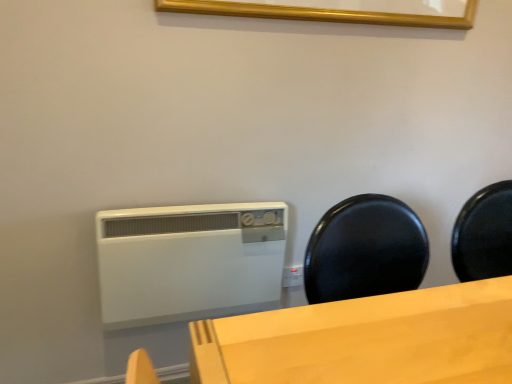
The width and height of the screenshot is (512, 384). I want to click on gold wooden picture frame at upper center, so click(335, 12).

What is the approximate height of gold wooden picture frame at upper center?

The height of gold wooden picture frame at upper center is 4.06 inches.

Describe the element at coordinates (335, 12) in the screenshot. The image size is (512, 384). I see `gold wooden picture frame at upper center` at that location.

What do you see at coordinates (189, 261) in the screenshot? This screenshot has width=512, height=384. I see `white plastic heater at center` at bounding box center [189, 261].

You are a GUI agent. You are given a task and a screenshot of the screen. Output one action in this format:
    pyautogui.click(x=<x>, y=<y>)
    Task: Click on the white plastic heater at center
    This screenshot has height=384, width=512.
    Given the screenshot: What is the action you would take?
    pyautogui.click(x=189, y=261)

Where is `gold wooden picture frame at upper center`? The width and height of the screenshot is (512, 384). gold wooden picture frame at upper center is located at coordinates (335, 12).

Is gold wooden picture frame at upper center at the left side of white plastic heater at center?

No.

Which object is more forward, gold wooden picture frame at upper center or white plastic heater at center?

gold wooden picture frame at upper center is in front.

Between point (405, 22) and point (227, 209), which one is positioned behind?

Point (227, 209)

From the image's perspective, does gold wooden picture frame at upper center appear higher than white plastic heater at center?

Yes, from the image's perspective, gold wooden picture frame at upper center is above white plastic heater at center.

From a real-world perspective, is gold wooden picture frame at upper center over white plastic heater at center?

Yes, from a real-world perspective, gold wooden picture frame at upper center is over white plastic heater at center

Looking at their sizes, would you say gold wooden picture frame at upper center is wider or thinner than white plastic heater at center?

In the image, gold wooden picture frame at upper center appears to be more narrow than white plastic heater at center.

Between gold wooden picture frame at upper center and white plastic heater at center, which one has more height?

white plastic heater at center is taller.

Considering the relative sizes of gold wooden picture frame at upper center and white plastic heater at center in the image provided, is gold wooden picture frame at upper center smaller than white plastic heater at center?

Correct, gold wooden picture frame at upper center occupies less space than white plastic heater at center.

Is gold wooden picture frame at upper center inside or outside of white plastic heater at center?

gold wooden picture frame at upper center cannot be found inside white plastic heater at center.

Is gold wooden picture frame at upper center placed right next to white plastic heater at center?

gold wooden picture frame at upper center and white plastic heater at center are clearly separated.

Could you tell me if gold wooden picture frame at upper center is turned towards white plastic heater at center?

No, gold wooden picture frame at upper center is not facing towards white plastic heater at center.

How much distance is there between gold wooden picture frame at upper center and white plastic heater at center?

A distance of 30.20 inches exists between gold wooden picture frame at upper center and white plastic heater at center.

Identify the location of home appliance below the gold wooden picture frame at upper center (from the image's perspective). This screenshot has width=512, height=384. (189, 261).

Can you confirm if white plastic heater at center is positioned to the left of gold wooden picture frame at upper center?

Correct, you'll find white plastic heater at center to the left of gold wooden picture frame at upper center.

Which object is more forward, white plastic heater at center or gold wooden picture frame at upper center?

gold wooden picture frame at upper center is in front.

Which point is more distant from viewer, (243, 237) or (298, 8)?

The point (243, 237) is farther from the camera.

From the image's perspective, is white plastic heater at center positioned above or below gold wooden picture frame at upper center?

white plastic heater at center is below gold wooden picture frame at upper center.

From a real-world perspective, between white plastic heater at center and gold wooden picture frame at upper center, who is vertically lower?

white plastic heater at center.

Does white plastic heater at center have a lesser width compared to gold wooden picture frame at upper center?

Incorrect, the width of white plastic heater at center is not less than that of gold wooden picture frame at upper center.

In terms of height, does white plastic heater at center look taller or shorter compared to gold wooden picture frame at upper center?

Clearly, white plastic heater at center is taller compared to gold wooden picture frame at upper center.

Does white plastic heater at center have a smaller size compared to gold wooden picture frame at upper center?

No, white plastic heater at center is not smaller than gold wooden picture frame at upper center.

Is white plastic heater at center situated inside gold wooden picture frame at upper center or outside?

white plastic heater at center is not inside gold wooden picture frame at upper center, it's outside.

Can you see white plastic heater at center touching gold wooden picture frame at upper center?

white plastic heater at center and gold wooden picture frame at upper center are not in contact.

Is white plastic heater at center aimed at gold wooden picture frame at upper center?

No, white plastic heater at center is not facing towards gold wooden picture frame at upper center.

Measure the distance from white plastic heater at center to gold wooden picture frame at upper center.

white plastic heater at center and gold wooden picture frame at upper center are 76.70 centimeters apart.

Locate an element on the screen. picture frame that appears in front of the white plastic heater at center is located at coordinates (335, 12).

Where is `home appliance on the left of gold wooden picture frame at upper center`? The height and width of the screenshot is (384, 512). home appliance on the left of gold wooden picture frame at upper center is located at coordinates (189, 261).

The image size is (512, 384). Find the location of `home appliance below the gold wooden picture frame at upper center (from a real-world perspective)`. home appliance below the gold wooden picture frame at upper center (from a real-world perspective) is located at coordinates (189, 261).